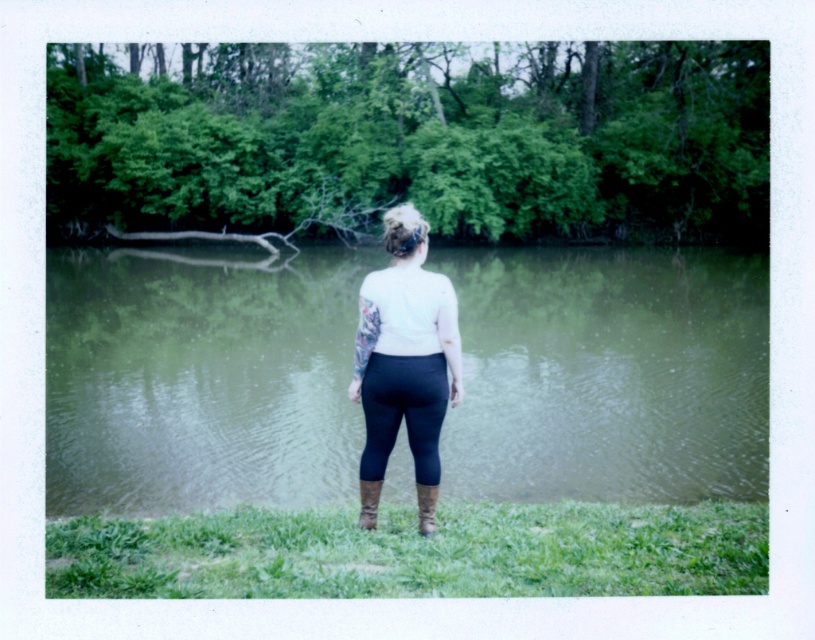
Looking at this image, you are a photographer trying to capture the person in the scene. If you want to ensure both the matte white shirt at center and the brown suede boot at lower center are clearly visible in your photo, which object should you focus on first to ensure proper focus?

The matte white shirt at center should be focused on first because it is larger than the brown suede boot at lower center, making it easier to achieve sharp focus.

You are a photographer trying to capture a wide shot of the scene. You need to ensure that both the green reflective water at center and the matte white shirt at center are fully visible in the frame. Based on their relative widths, do you think this is possible?

The green reflective water at center might be wider than the matte white shirt at center, so it is possible to capture both in the frame as they are positioned at the center and their widths allow for inclusion in a wide shot.

You are a photographer positioned at the edge of the pond. You want to capture a photo of the black matte leggings at center without the green reflective water at center appearing in the foreground. Is this possible based on their positions?

The black matte leggings at center is behind the green reflective water at center, so it is not possible to capture the black matte leggings at center without the green reflective water at center appearing in the foreground.